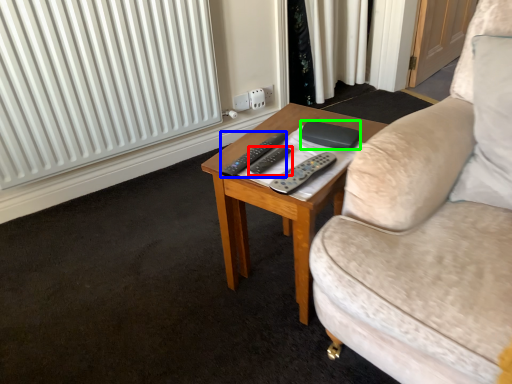
Question: Estimate the real-world distances between objects in this image. Which object is farther from remote control (highlighted by a red box), remote control (highlighted by a blue box) or pad (highlighted by a green box)?

Choices:
 (A) remote control
 (B) pad

Answer: (B)